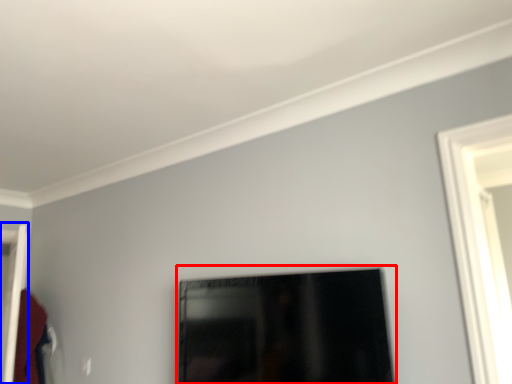
Question: Which object is further to the camera taking this photo, picture frame (highlighted by a red box) or door (highlighted by a blue box)?

Choices:
 (A) picture frame
 (B) door

Answer: (B)